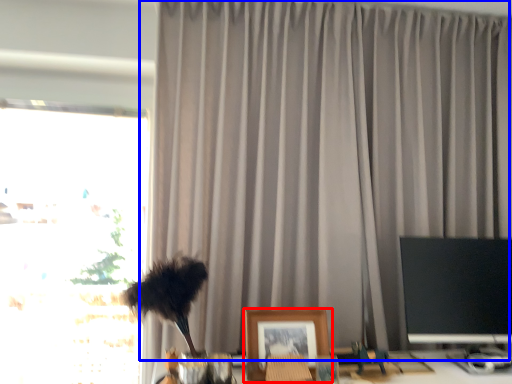
Question: Which point is closer to the camera, picture frame (highlighted by a red box) or curtain (highlighted by a blue box)?

Choices:
 (A) picture frame
 (B) curtain

Answer: (A)